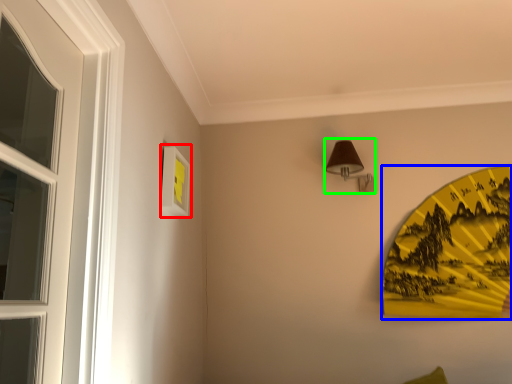
Question: Which is nearer to the picture frame (highlighted by a red box)? design (highlighted by a blue box) or lamp (highlighted by a green box).

Choices:
 (A) design
 (B) lamp

Answer: (B)